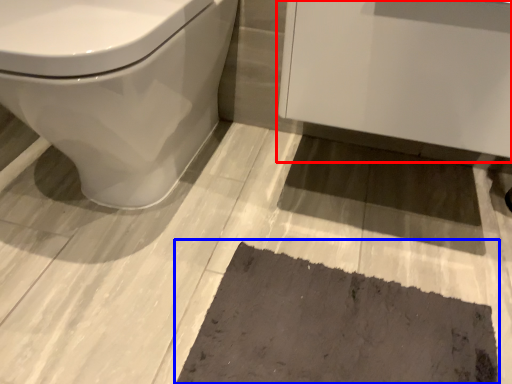
Question: Among these objects, which one is nearest to the camera, porcelain (highlighted by a red box) or bath mat (highlighted by a blue box)?

Choices:
 (A) porcelain
 (B) bath mat

Answer: (A)